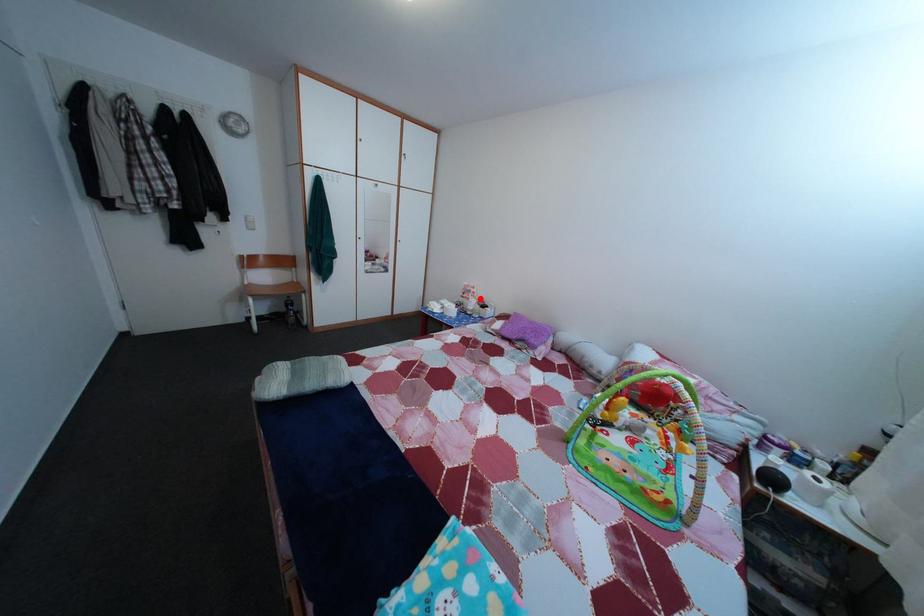
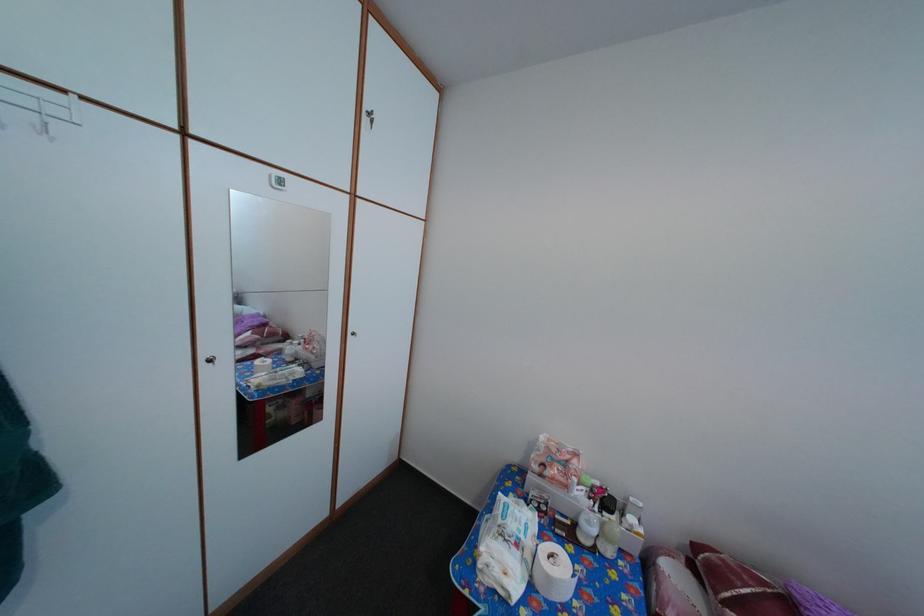
Find the pixel in the second image that matches the highlighted location in the first image.

(576, 469)